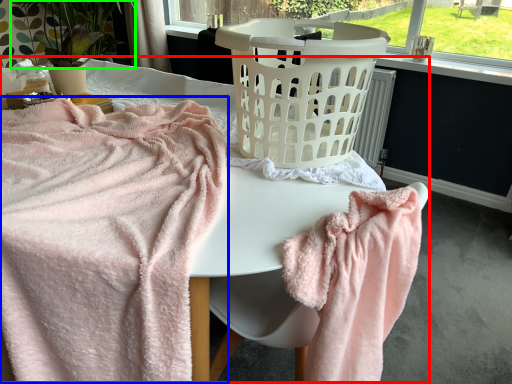
Question: Which is farther away from bed (highlighted by a red box)? towel (highlighted by a blue box) or plant (highlighted by a green box)?

Choices:
 (A) towel
 (B) plant

Answer: (B)